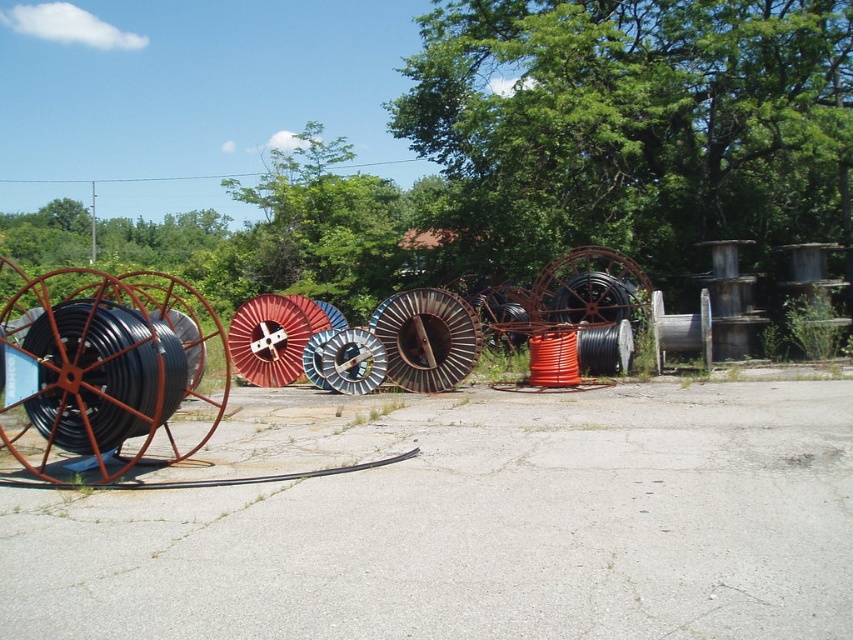
Between rusty metal wheel at center and matte black spool at center, which one has less height?

matte black spool at center is shorter.

Is rusty metal wheel at center behind matte black spool at center?

No, it is in front of matte black spool at center.

Is point (432, 392) less distant than point (593, 296)?

That is True.

The image size is (853, 640). Identify the location of rusty metal wheel at center. (427, 339).

Is rusty metal wheel at center shorter than red matte spool at center?

Correct, rusty metal wheel at center is not as tall as red matte spool at center.

You are a GUI agent. You are given a task and a screenshot of the screen. Output one action in this format:
    pyautogui.click(x=<x>, y=<y>)
    Task: Click on the rusty metal wheel at center
    This screenshot has height=640, width=853.
    Given the screenshot: What is the action you would take?
    pyautogui.click(x=427, y=339)

Does point (453, 342) lie in front of point (271, 332)?

That is True.

The width and height of the screenshot is (853, 640). What are the coordinates of `rusty metal wheel at center` in the screenshot? It's located at coord(427,339).

Is black matte cable reel at left to the right of metallic silver cable reel at center from the viewer's perspective?

Incorrect, black matte cable reel at left is not on the right side of metallic silver cable reel at center.

Describe the element at coordinates (93, 372) in the screenshot. The height and width of the screenshot is (640, 853). I see `black matte cable reel at left` at that location.

The image size is (853, 640). Identify the location of black matte cable reel at left. (93, 372).